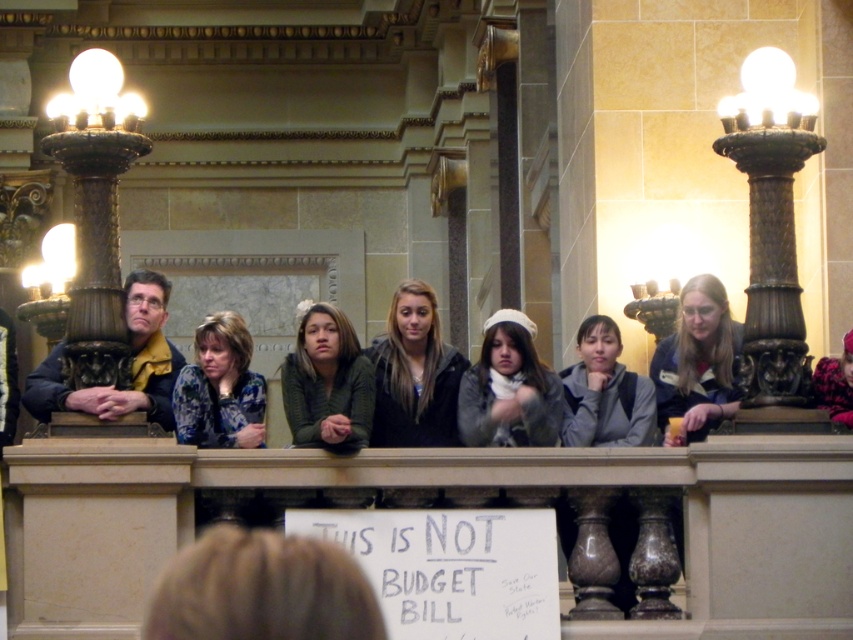
Question: Does dark brown hair at center appear on the left side of metallic gold lamp at left?

Choices:
 (A) no
 (B) yes

Answer: (A)

Question: Estimate the real-world distances between objects in this image. Which object is farther from the bronze/golden pillar at right?

Choices:
 (A) metallic gold lamp at left
 (B) green fuzzy sweater at center

Answer: (A)

Question: Is matte blue shirt at center thinner than metallic gold lamp at left?

Choices:
 (A) no
 (B) yes

Answer: (B)

Question: Which object is positioned closest to the fluffy pink coat at center?

Choices:
 (A) gray fabric jacket at center
 (B) green fuzzy sweater at center
 (C) blue floral blouse at center

Answer: (A)

Question: Estimate the real-world distances between objects in this image. Which object is closer to the bronze/golden pillar at right?

Choices:
 (A) metallic gold lamp at left
 (B) dark blue jacket at left
 (C) blonde hair at lower center
 (D) gray fabric jacket at center

Answer: (D)

Question: Is bronze/golden pillar at right thinner than dark blue jacket at left?

Choices:
 (A) yes
 (B) no

Answer: (A)